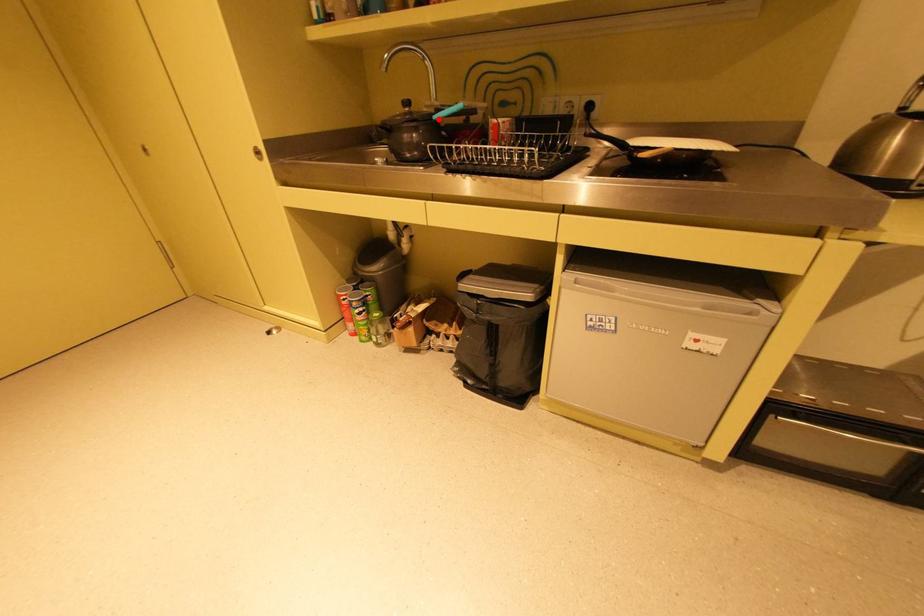
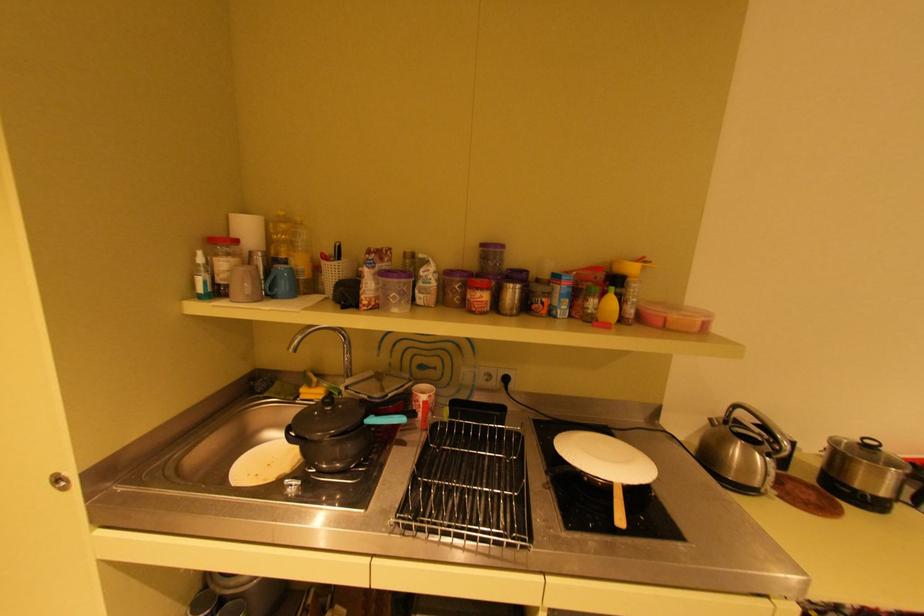
Locate, in the second image, the point that corresponds to the highlighted location in the first image.

(371, 424)